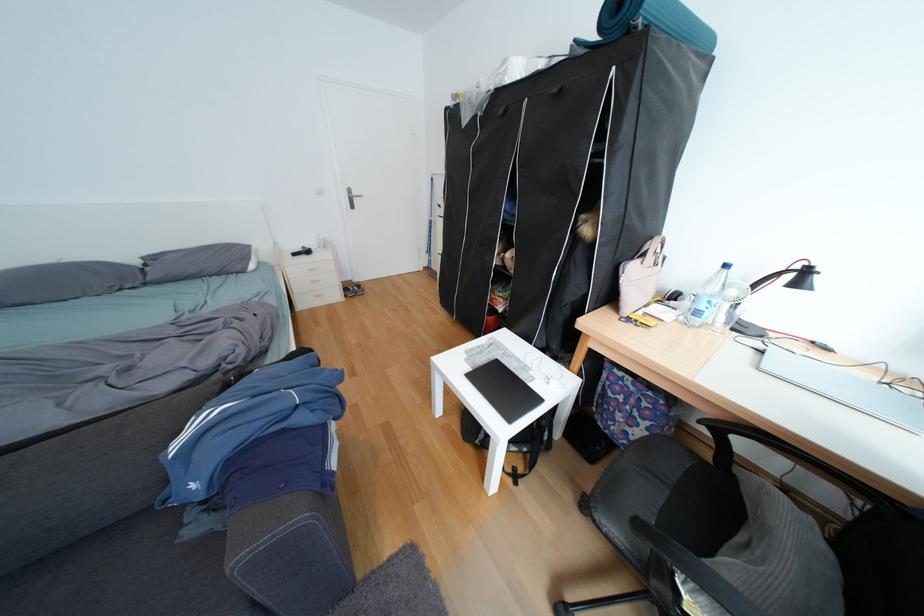
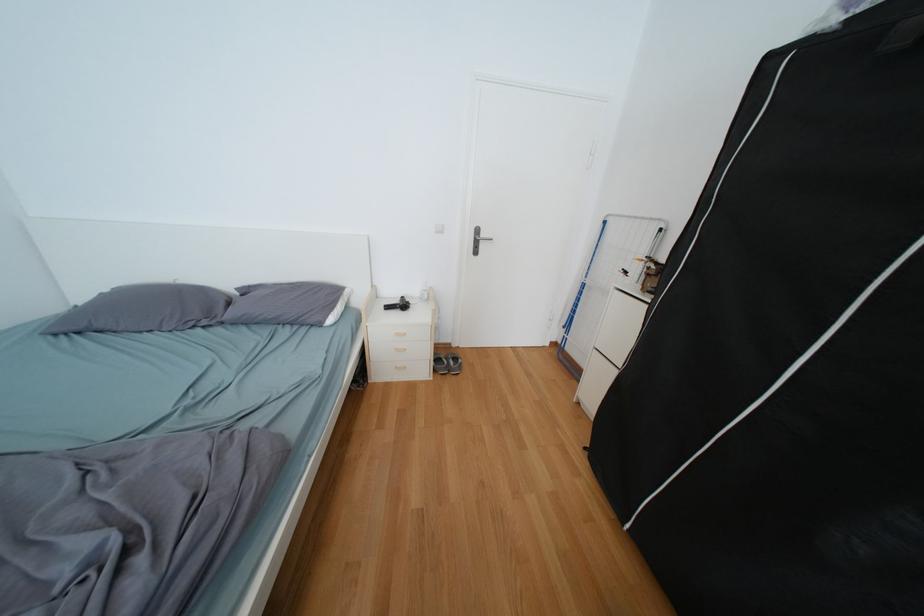
The point at (159, 285) is marked in the first image. Where is the corresponding point in the second image?

(235, 323)